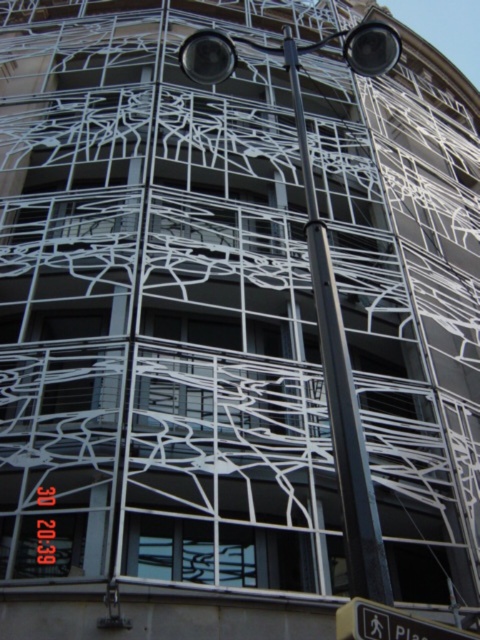
You are a delivery person with a cart that is 1.5 meters wide. You need to navigate between the black metal pole at center and the yellow plastic pedestrian sign at lower right. Can your cart fit through the space between them?

The distance between the black metal pole at center and the yellow plastic pedestrian sign at lower right is 8.84 meters. Since your cart is only 1.5 meters wide, it can easily fit through the space between them.

You are a pedestrian approaching the building and notice the black metal pole at center and the yellow plastic pedestrian sign at lower right. Which object is closer to you as you walk towards the building?

The black metal pole at center is closer to you than the yellow plastic pedestrian sign at lower right because it is further to the viewer.